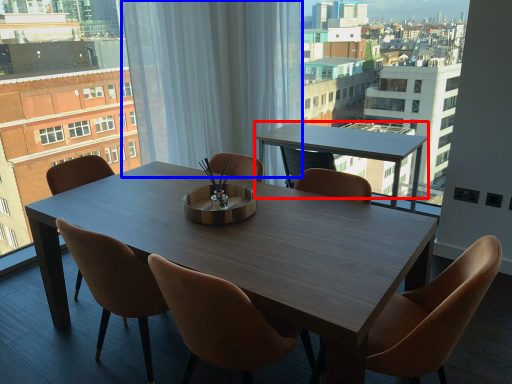
Question: Among these objects, which one is nearest to the camera, coffee table (highlighted by a red box) or curtain (highlighted by a blue box)?

Choices:
 (A) coffee table
 (B) curtain

Answer: (A)